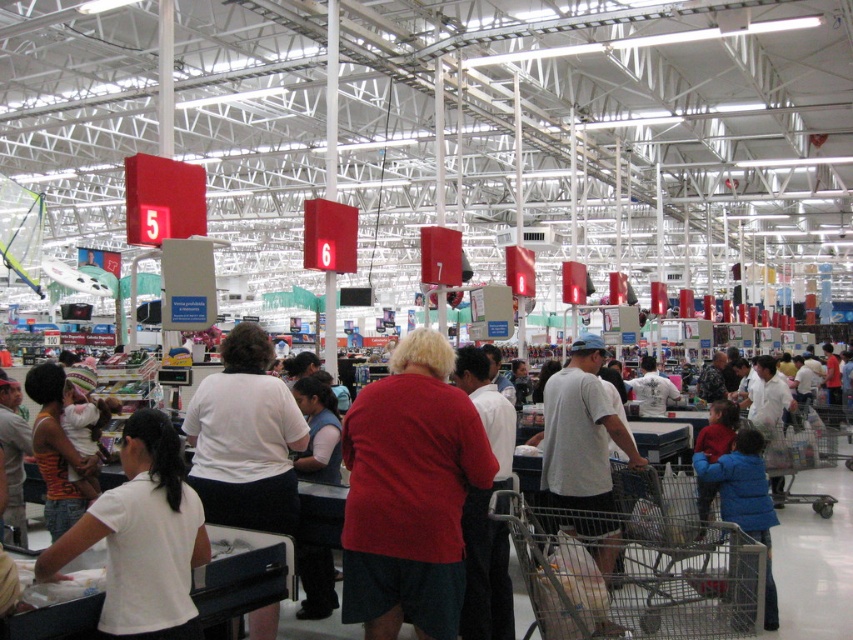
Question: Which object is closer to the camera taking this photo?

Choices:
 (A) striped knit hat at lower left
 (B) white matte shirt at center
 (C) matte red shirt at center
 (D) red matte shirt at center

Answer: (D)

Question: Which of the following is the farthest from the observer?

Choices:
 (A) (198, 564)
 (B) (601, 403)

Answer: (B)

Question: Does white cotton t-shirt at center appear on the left side of matte red shirt at center?

Choices:
 (A) no
 (B) yes

Answer: (A)

Question: Observing the image, what is the correct spatial positioning of white cotton shirt at lower left in reference to white matte shirt at center?

Choices:
 (A) above
 (B) below

Answer: (B)

Question: Considering the relative positions of metallic silver shopping cart at lower right and white matte shirt at center in the image provided, where is metallic silver shopping cart at lower right located with respect to white matte shirt at center?

Choices:
 (A) right
 (B) left

Answer: (A)

Question: Which of the following is the farthest from the observer?

Choices:
 (A) (200, 416)
 (B) (451, 513)
 (C) (560, 550)

Answer: (A)